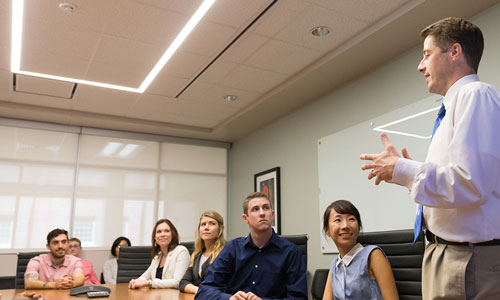
You are a GUI agent. You are given a task and a screenshot of the screen. Output one action in this format:
    pyautogui.click(x=<x>, y=<y>)
    Task: Click on the window panes
    The height and width of the screenshot is (300, 500).
    Given the screenshot: What is the action you would take?
    pyautogui.click(x=199, y=164), pyautogui.click(x=117, y=153), pyautogui.click(x=44, y=146), pyautogui.click(x=181, y=199), pyautogui.click(x=114, y=202), pyautogui.click(x=38, y=202)